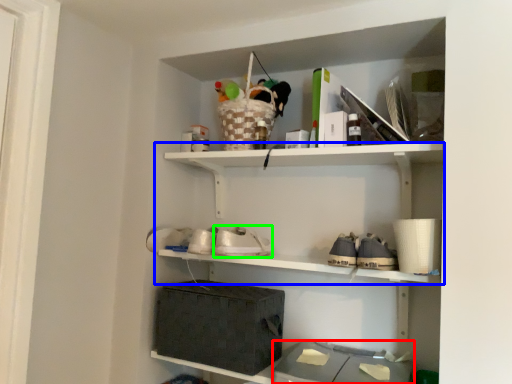
Question: Which is nearer to the storage box (highlighted by a red box)? shelf (highlighted by a blue box) or shoe (highlighted by a green box).

Choices:
 (A) shelf
 (B) shoe

Answer: (B)